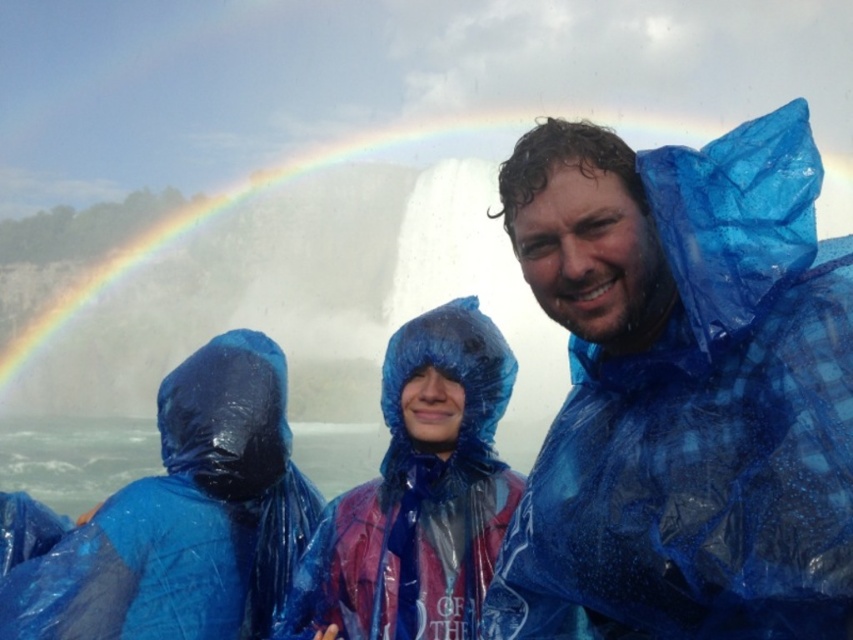
From the picture: Is blue translucent poncho at left wider than transparent blue poncho at center?

Indeed, blue translucent poncho at left has a greater width compared to transparent blue poncho at center.

In the scene shown: Is blue translucent poncho at left behind transparent blue poncho at center?

No.

Between point (88, 557) and point (415, 330), which one is positioned behind?

The point (415, 330) is more distant.

Where is `blue translucent poncho at left`? This screenshot has height=640, width=853. blue translucent poncho at left is located at coordinates (184, 518).

Who is more forward, (676,561) or (490,397)?

Point (676,561) is more forward.

What do you see at coordinates (683, 392) in the screenshot? I see `blue translucent raincoat at center` at bounding box center [683, 392].

Is point (740, 252) closer to camera compared to point (422, 460)?

Yes, it is.

You are a GUI agent. You are given a task and a screenshot of the screen. Output one action in this format:
    pyautogui.click(x=<x>, y=<y>)
    Task: Click on the blue translucent raincoat at center
    
    Given the screenshot: What is the action you would take?
    pyautogui.click(x=683, y=392)

Which is below, blue translucent raincoat at center or blue translucent poncho at left?

blue translucent poncho at left is lower down.

Is blue translucent raincoat at center bigger than blue translucent poncho at left?

Yes.

Where is `blue translucent raincoat at center`? This screenshot has width=853, height=640. blue translucent raincoat at center is located at coordinates (683, 392).